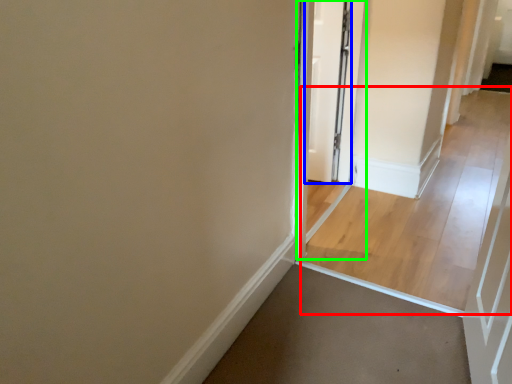
Question: Considering the real-world distances, which object is farthest from path (highlighted by a red box)? door (highlighted by a blue box) or screen door (highlighted by a green box)?

Choices:
 (A) door
 (B) screen door

Answer: (A)